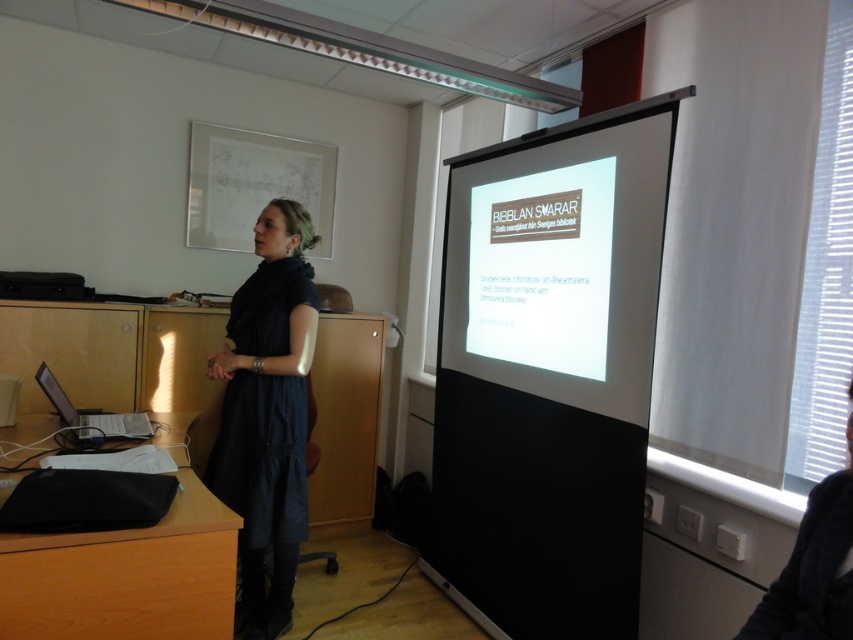
Question: Is the position of dark gray sweater at lower right less distant than that of matte black laptop at left?

Choices:
 (A) yes
 (B) no

Answer: (A)

Question: Does white glossy projection screen at center lie in front of dark gray sweater at lower right?

Choices:
 (A) yes
 (B) no

Answer: (B)

Question: Which of the following is the closest to the observer?

Choices:
 (A) (41, 376)
 (B) (524, 371)

Answer: (A)

Question: Does dark blue dress at center appear on the right side of matte black laptop at left?

Choices:
 (A) no
 (B) yes

Answer: (B)

Question: Which point appears closest to the camera in this image?

Choices:
 (A) (134, 428)
 (B) (288, 362)
 (C) (543, 349)

Answer: (B)

Question: Which point is closer to the camera taking this photo?

Choices:
 (A) (643, 390)
 (B) (274, 289)

Answer: (A)